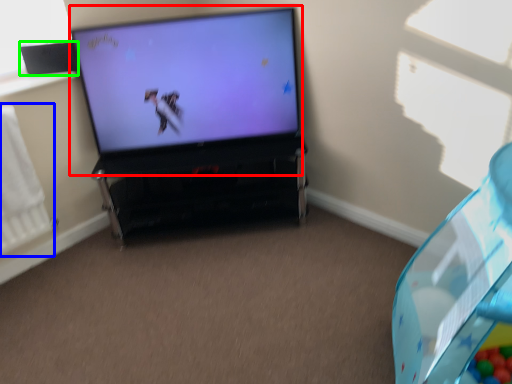
Question: Which is nearer to the television (highlighted by a red box)? radiator (highlighted by a blue box) or speaker (highlighted by a green box).

Choices:
 (A) radiator
 (B) speaker

Answer: (B)